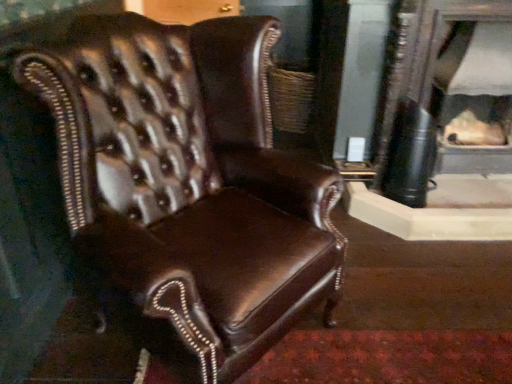
This screenshot has width=512, height=384. Find the location of `matte black fireplace at center`. matte black fireplace at center is located at coordinates (447, 96).

What is the approximate width of matte black fireplace at center?

matte black fireplace at center is 41.70 centimeters wide.

What do you see at coordinates (447, 96) in the screenshot? I see `matte black fireplace at center` at bounding box center [447, 96].

The width and height of the screenshot is (512, 384). What are the coordinates of `brown leather chair at center` in the screenshot? It's located at (188, 183).

Describe the element at coordinates (188, 183) in the screenshot. I see `brown leather chair at center` at that location.

In order to face brown leather chair at center, should I rotate leftwards or rightwards?

You should look left and rotate roughly 8.420 degrees.

Where is `matte black fireplace at center`? The height and width of the screenshot is (384, 512). matte black fireplace at center is located at coordinates (447, 96).

Between brown leather chair at center and matte black fireplace at center, which one appears on the left side from the viewer's perspective?

From the viewer's perspective, brown leather chair at center appears more on the left side.

Is brown leather chair at center positioned behind matte black fireplace at center?

No, brown leather chair at center is in front of matte black fireplace at center.

Between point (169, 207) and point (461, 99), which one is positioned behind?

The point (461, 99) is farther.

From the image's perspective, is brown leather chair at center positioned above or below matte black fireplace at center?

brown leather chair at center is situated lower than matte black fireplace at center in the image.

From a real-world perspective, between brown leather chair at center and matte black fireplace at center, who is vertically higher?

From a 3D spatial view, brown leather chair at center is above.

Which object is wider, brown leather chair at center or matte black fireplace at center?

With larger width is brown leather chair at center.

Which of these two, brown leather chair at center or matte black fireplace at center, stands taller?

brown leather chair at center.

Between brown leather chair at center and matte black fireplace at center, which one has larger size?

With larger size is brown leather chair at center.

Is brown leather chair at center positioned beyond the bounds of matte black fireplace at center?

Yes, brown leather chair at center is not within matte black fireplace at center.

Is the surface of brown leather chair at center in direct contact with matte black fireplace at center?

No.

Is brown leather chair at center looking in the opposite direction of matte black fireplace at center?

brown leather chair at center does not have its back to matte black fireplace at center.

How far apart are brown leather chair at center and matte black fireplace at center?

brown leather chair at center is 3.90 feet from matte black fireplace at center.

Locate an element on the screen. The width and height of the screenshot is (512, 384). fireplace behind the brown leather chair at center is located at coordinates (447, 96).

Can you confirm if matte black fireplace at center is positioned to the right of brown leather chair at center?

Yes.

In the image, is matte black fireplace at center positioned in front of or behind brown leather chair at center?

matte black fireplace at center is behind brown leather chair at center.

Is point (485, 6) closer or farther from the camera than point (129, 158)?

Clearly, point (485, 6) is more distant from the camera than point (129, 158).

In the scene shown: From the image's perspective, is matte black fireplace at center on top of brown leather chair at center?

Correct, matte black fireplace at center appears higher than brown leather chair at center in the image.

From a real-world perspective, does matte black fireplace at center sit lower than brown leather chair at center?

Correct, in the physical world, matte black fireplace at center is lower than brown leather chair at center.

Which of these two, matte black fireplace at center or brown leather chair at center, is thinner?

Thinner between the two is matte black fireplace at center.

Considering the relative sizes of matte black fireplace at center and brown leather chair at center in the image provided, is matte black fireplace at center taller than brown leather chair at center?

No, matte black fireplace at center is not taller than brown leather chair at center.

Which of these two, matte black fireplace at center or brown leather chair at center, is bigger?

brown leather chair at center is bigger.

Is matte black fireplace at center inside the boundaries of brown leather chair at center, or outside?

matte black fireplace at center is not inside brown leather chair at center, it's outside.

Is matte black fireplace at center placed right next to brown leather chair at center?

No, matte black fireplace at center is not beside brown leather chair at center.

Is matte black fireplace at center oriented towards brown leather chair at center?

No.

Can you tell me how much matte black fireplace at center and brown leather chair at center differ in facing direction?

The facing directions of matte black fireplace at center and brown leather chair at center are 47.5 degrees apart.

I want to click on fireplace above the brown leather chair at center (from the image's perspective), so click(447, 96).

The width and height of the screenshot is (512, 384). What are the coordinates of `fireplace below the brown leather chair at center (from a real-world perspective)` in the screenshot? It's located at (447, 96).

In the image, there is a brown leather chair at center. Identify the location of fireplace above it (from the image's perspective). (447, 96).